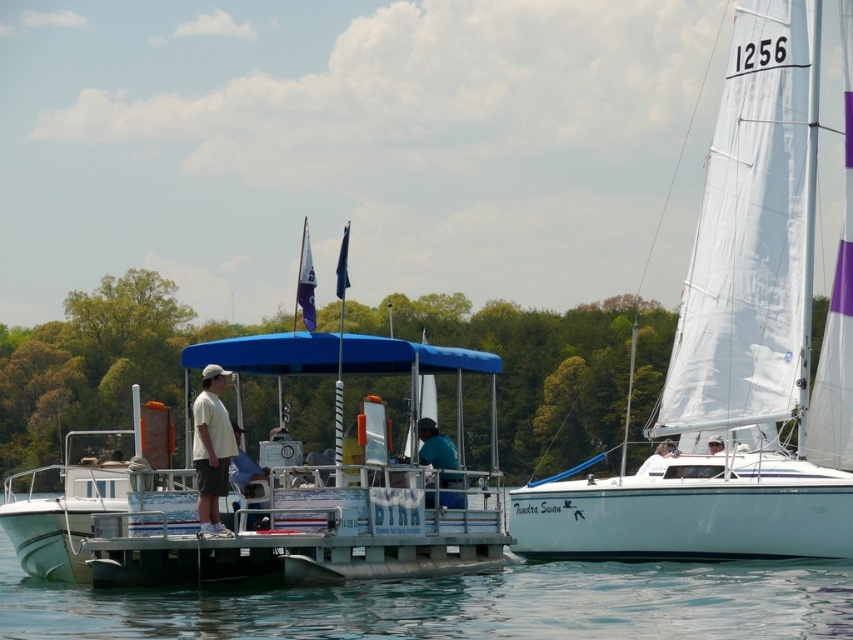
Question: Estimate the real-world distances between objects in this image. Which object is farther from the white matte shirt at center?

Choices:
 (A) transparent water at center
 (B) white matte pontoon boat at center
 (C) white sail at right

Answer: (C)

Question: Can you confirm if white sail at right is positioned above white matte shirt at center?

Choices:
 (A) no
 (B) yes

Answer: (B)

Question: Is transparent water at center behind dark blue shirt at center?

Choices:
 (A) yes
 (B) no

Answer: (B)

Question: Which is nearer to the white sail at right?

Choices:
 (A) white matte pontoon boat at center
 (B) white matte shirt at center
 (C) transparent water at center
 (D) dark blue shirt at center

Answer: (C)

Question: Which point is closer to the camera?

Choices:
 (A) (461, 497)
 (B) (798, 96)
 (C) (13, 532)

Answer: (A)

Question: Can you confirm if white sail at right is positioned to the left of white matte shirt at center?

Choices:
 (A) no
 (B) yes

Answer: (A)